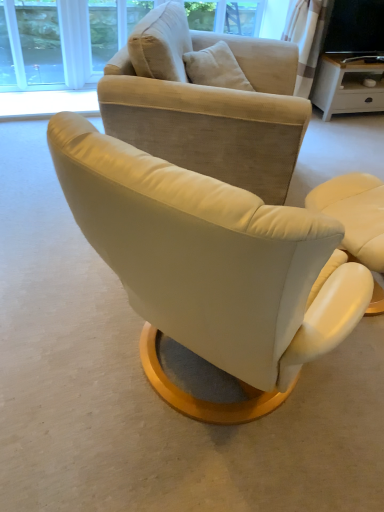
Measure the distance between leather armchair at center, positioned as the second chair in right-to-left order, and camera.

leather armchair at center, positioned as the second chair in right-to-left order, and camera are 25.84 inches apart from each other.

Image resolution: width=384 pixels, height=512 pixels. I want to click on leather armchair at center, the second chair when ordered from left to right, so click(x=211, y=267).

The image size is (384, 512). In order to click on matte white desk at upper right in this screenshot , I will do `click(348, 86)`.

The height and width of the screenshot is (512, 384). What do you see at coordinates (355, 28) in the screenshot?
I see `matte black tv at upper right` at bounding box center [355, 28].

Describe the element at coordinates (215, 116) in the screenshot. I see `suede beige armchair at center, which ranks as the 3th chair in right-to-left order` at that location.

Where is `matte cream armchair at center, acting as the 3th chair starting from the left`? matte cream armchair at center, acting as the 3th chair starting from the left is located at coordinates (355, 214).

Where is `leather armchair at center, the second chair when ordered from left to right`? leather armchair at center, the second chair when ordered from left to right is located at coordinates (211, 267).

Is matte cream armchair at center, which appears as the 1th chair when viewed from the right, oriented towards matte white desk at upper right?

No, matte cream armchair at center, which appears as the 1th chair when viewed from the right, is not turned towards matte white desk at upper right.

From a real-world perspective, which object rests below the other?

In real-world perspective, matte white desk at upper right is lower.

Between point (342, 212) and point (337, 55), which one is positioned behind?

The point (337, 55) is more distant.

Can you confirm if matte white desk at upper right is wider than matte black tv at upper right?

Indeed, matte white desk at upper right has a greater width compared to matte black tv at upper right.

Is point (360, 92) less distant than point (383, 22)?

No, it is behind (383, 22).

How many degrees apart are the facing directions of matte white desk at upper right and matte black tv at upper right?

The angle between the facing direction of matte white desk at upper right and the facing direction of matte black tv at upper right is 0.00259 degrees.

From the image's perspective, which is above, matte white desk at upper right or matte black tv at upper right?

matte black tv at upper right, from the image's perspective.

Is leather armchair at center, the second chair when ordered from left to right, inside or outside of matte black tv at upper right?

leather armchair at center, the second chair when ordered from left to right, cannot be found inside matte black tv at upper right.

Considering the relative sizes of leather armchair at center, positioned as the second chair in right-to-left order, and matte black tv at upper right in the image provided, is leather armchair at center, positioned as the second chair in right-to-left order, shorter than matte black tv at upper right?

Yes, leather armchair at center, positioned as the second chair in right-to-left order, is shorter than matte black tv at upper right.

Between point (193, 245) and point (335, 11), which one is positioned behind?

Point (335, 11)

Consider the image. Is leather armchair at center, the second chair when ordered from left to right, oriented away from matte black tv at upper right?

No.

At what (x,y) coordinates should I click in order to perform the action: click on chair on the right of leather armchair at center, the second chair when ordered from left to right. Please return your answer as a coordinate pair (x, y). Looking at the image, I should click on (355, 214).

Considering the positions of objects leather armchair at center, positioned as the second chair in right-to-left order, and matte cream armchair at center, acting as the 3th chair starting from the left, in the image provided, who is more to the right, leather armchair at center, positioned as the second chair in right-to-left order, or matte cream armchair at center, acting as the 3th chair starting from the left,?

matte cream armchair at center, acting as the 3th chair starting from the left, is more to the right.

Is point (157, 176) closer or farther from the camera than point (322, 195)?

Point (157, 176) is positioned closer to the camera compared to point (322, 195).

Can you tell me how much leather armchair at center, the second chair when ordered from left to right, and matte cream armchair at center, acting as the 3th chair starting from the left, differ in facing direction?

leather armchair at center, the second chair when ordered from left to right, and matte cream armchair at center, acting as the 3th chair starting from the left, are facing 79.1 degrees away from each other.

Considering the relative positions of matte white desk at upper right and leather armchair at center, positioned as the second chair in right-to-left order, in the image provided, is matte white desk at upper right to the left of leather armchair at center, positioned as the second chair in right-to-left order, from the viewer's perspective?

Incorrect, matte white desk at upper right is not on the left side of leather armchair at center, positioned as the second chair in right-to-left order.

Looking at this image, considering the sizes of objects matte white desk at upper right and leather armchair at center, positioned as the second chair in right-to-left order, in the image provided, who is smaller, matte white desk at upper right or leather armchair at center, positioned as the second chair in right-to-left order,?

Smaller between the two is matte white desk at upper right.

Which of these two, matte white desk at upper right or leather armchair at center, the second chair when ordered from left to right, is thinner?

matte white desk at upper right is thinner.

Does matte cream armchair at center, which appears as the 1th chair when viewed from the right, have a greater height compared to matte black tv at upper right?

Indeed, matte cream armchair at center, which appears as the 1th chair when viewed from the right, has a greater height compared to matte black tv at upper right.

Image resolution: width=384 pixels, height=512 pixels. I want to click on chair that is the 1st one when counting leftward from the matte black tv at upper right, so click(355, 214).

Consider the image. Is matte cream armchair at center, acting as the 3th chair starting from the left, positioned far away from matte black tv at upper right?

Yes, matte cream armchair at center, acting as the 3th chair starting from the left, is far from matte black tv at upper right.

Does matte cream armchair at center, acting as the 3th chair starting from the left, lie in front of matte black tv at upper right?

Yes, matte cream armchair at center, acting as the 3th chair starting from the left, is in front of matte black tv at upper right.

Which object is thinner, matte black tv at upper right or leather armchair at center, positioned as the second chair in right-to-left order?

Thinner between the two is matte black tv at upper right.

Is matte black tv at upper right closer to the viewer compared to leather armchair at center, positioned as the second chair in right-to-left order?

No, it is behind leather armchair at center, positioned as the second chair in right-to-left order.

Can you confirm if matte black tv at upper right is bigger than leather armchair at center, the second chair when ordered from left to right?

Actually, matte black tv at upper right might be smaller than leather armchair at center, the second chair when ordered from left to right.

Locate an element on the screen. The width and height of the screenshot is (384, 512). desk on the right of matte cream armchair at center, which appears as the 1th chair when viewed from the right is located at coordinates (348, 86).

Where is `desk lying behind the matte black tv at upper right`? This screenshot has height=512, width=384. desk lying behind the matte black tv at upper right is located at coordinates (348, 86).

When comparing their distances from matte cream armchair at center, which appears as the 1th chair when viewed from the right, does matte black tv at upper right or leather armchair at center, the second chair when ordered from left to right, seem further?

matte black tv at upper right.

From the picture: Looking at the image, which one is located further to matte white desk at upper right, leather armchair at center, positioned as the second chair in right-to-left order, or matte black tv at upper right?

leather armchair at center, positioned as the second chair in right-to-left order, is further to matte white desk at upper right.

Looking at this image, which object lies further to the anchor point leather armchair at center, positioned as the second chair in right-to-left order, suede beige armchair at center, arranged as the first chair when viewed from the left, or matte white desk at upper right?

The object further to leather armchair at center, positioned as the second chair in right-to-left order, is matte white desk at upper right.

Based on their spatial positions, is matte black tv at upper right or matte white desk at upper right closer to leather armchair at center, the second chair when ordered from left to right?

matte white desk at upper right lies closer to leather armchair at center, the second chair when ordered from left to right, than the other object.

Considering their positions, is matte white desk at upper right positioned further to matte cream armchair at center, which appears as the 1th chair when viewed from the right, than leather armchair at center, the second chair when ordered from left to right?

matte white desk at upper right.

Looking at the image, which one is located closer to matte black tv at upper right, matte cream armchair at center, which appears as the 1th chair when viewed from the right, or suede beige armchair at center, arranged as the first chair when viewed from the left?

suede beige armchair at center, arranged as the first chair when viewed from the left, is closer to matte black tv at upper right.

Looking at the image, which one is located closer to matte black tv at upper right, suede beige armchair at center, which ranks as the 3th chair in right-to-left order, or matte cream armchair at center, acting as the 3th chair starting from the left?

suede beige armchair at center, which ranks as the 3th chair in right-to-left order, lies closer to matte black tv at upper right than the other object.

Looking at the image, which one is located further to suede beige armchair at center, which ranks as the 3th chair in right-to-left order, leather armchair at center, positioned as the second chair in right-to-left order, or matte black tv at upper right?

Among the two, matte black tv at upper right is located further to suede beige armchair at center, which ranks as the 3th chair in right-to-left order.

The width and height of the screenshot is (384, 512). I want to click on television between matte cream armchair at center, which appears as the 1th chair when viewed from the right, and matte white desk at upper right in the front-back direction, so click(x=355, y=28).

Find the location of `television located between suede beige armchair at center, arranged as the first chair when viewed from the left, and matte white desk at upper right in the depth direction`. television located between suede beige armchair at center, arranged as the first chair when viewed from the left, and matte white desk at upper right in the depth direction is located at coordinates (355, 28).

The width and height of the screenshot is (384, 512). Find the location of `chair between matte cream armchair at center, acting as the 3th chair starting from the left, and matte white desk at upper right in the front-back direction`. chair between matte cream armchair at center, acting as the 3th chair starting from the left, and matte white desk at upper right in the front-back direction is located at coordinates pos(215,116).

The image size is (384, 512). Find the location of `chair between suede beige armchair at center, which ranks as the 3th chair in right-to-left order, and matte cream armchair at center, acting as the 3th chair starting from the left, vertically`. chair between suede beige armchair at center, which ranks as the 3th chair in right-to-left order, and matte cream armchair at center, acting as the 3th chair starting from the left, vertically is located at coordinates (211, 267).